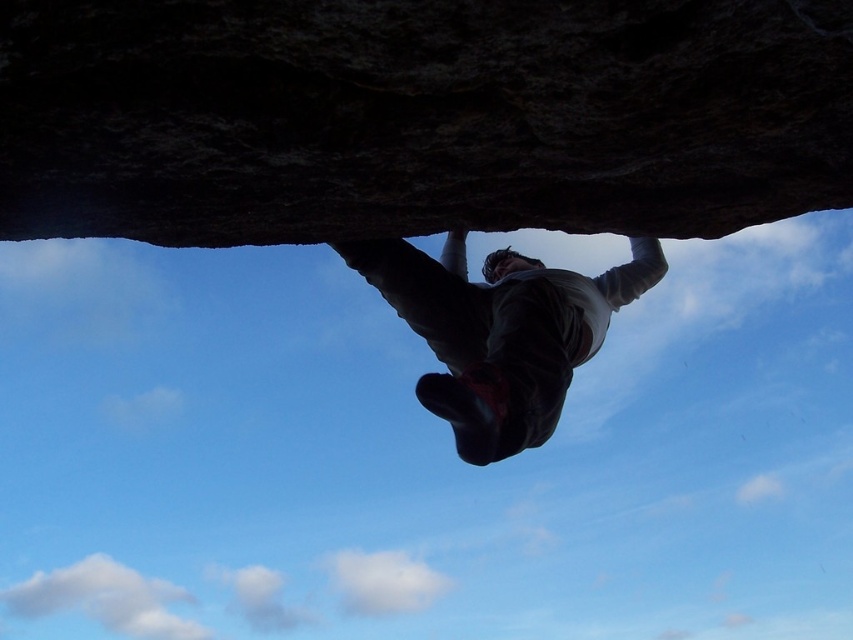
Does dark rock cliff at upper center have a lesser width compared to dark gray fabric climbing harness at center?

In fact, dark rock cliff at upper center might be wider than dark gray fabric climbing harness at center.

Where is `dark rock cliff at upper center`? dark rock cliff at upper center is located at coordinates click(x=418, y=116).

The image size is (853, 640). What do you see at coordinates (418, 116) in the screenshot? I see `dark rock cliff at upper center` at bounding box center [418, 116].

Where is `dark rock cliff at upper center`? This screenshot has width=853, height=640. dark rock cliff at upper center is located at coordinates tap(418, 116).